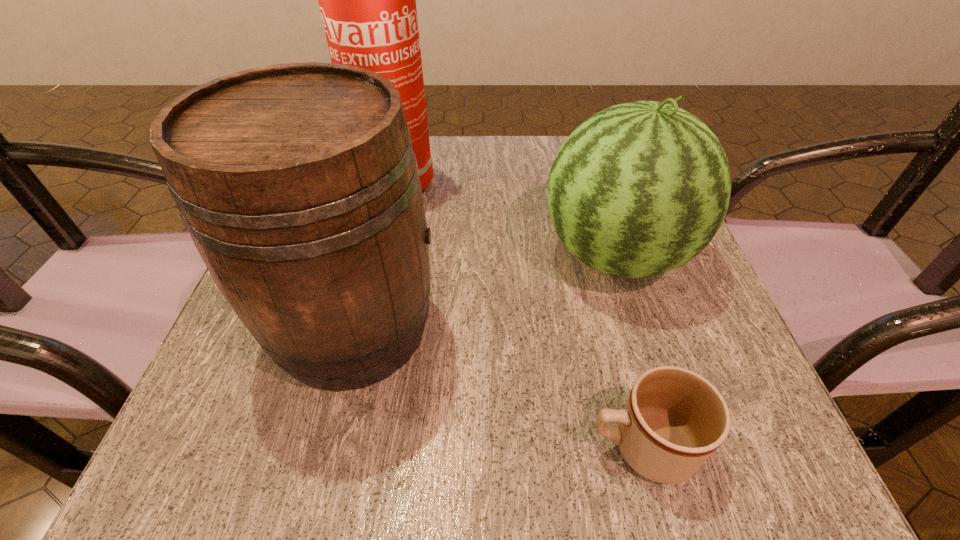
Find the location of a particular element. vacant area that lies between the tallest object and the shortest object is located at coordinates (511, 315).

Where is `free space between the cider and the third tallest object`? This screenshot has width=960, height=540. free space between the cider and the third tallest object is located at coordinates (485, 292).

Where is `vacant area that lies between the watermelon and the shortest object`? vacant area that lies between the watermelon and the shortest object is located at coordinates (628, 350).

Identify the location of free area in between the second shortest object and the mug. Image resolution: width=960 pixels, height=540 pixels. (628, 350).

Where is `free space between the second shortest object and the mug`? This screenshot has height=540, width=960. free space between the second shortest object and the mug is located at coordinates (628, 350).

Locate which object is the third closest to the mug. Please provide its 2D coordinates. Your answer should be formatted as a tuple, i.e. [(x, y)], where the tuple contains the x and y coordinates of a point satisfying the conditions above.

[(367, 0)]

Where is `object that stands as the third closest to the third shortest object`? object that stands as the third closest to the third shortest object is located at coordinates (673, 420).

Locate an element on the screen. free spot that satisfies the following two spatial constraints: 1. at the nozzle of the fire extinguisher; 2. on the side of the shortest object with the handle is located at coordinates (309, 446).

Where is `free space in the image that satisfies the following two spatial constraints: 1. on the front side of the watermelon; 2. on the side of the third shortest object near the bung hole`? This screenshot has height=540, width=960. free space in the image that satisfies the following two spatial constraints: 1. on the front side of the watermelon; 2. on the side of the third shortest object near the bung hole is located at coordinates (637, 328).

You are a GUI agent. You are given a task and a screenshot of the screen. Output one action in this format:
    pyautogui.click(x=<x>, y=<y>)
    Task: Click on the vacant region that satisfies the following two spatial constraints: 1. on the side of the third tallest object with the handle; 2. on the right side of the nearest object
    The height and width of the screenshot is (540, 960).
    Given the screenshot: What is the action you would take?
    pyautogui.click(x=592, y=255)